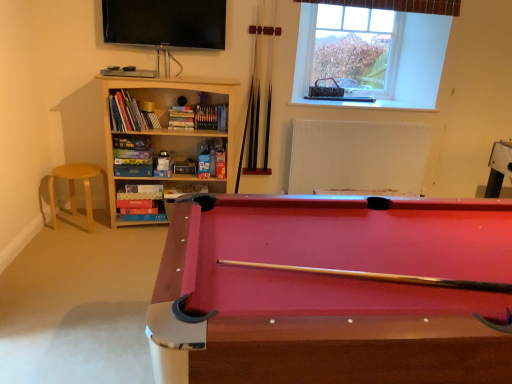
Question: From the image's perspective, is white matte radiator at upper center located above or below wooden bookcase at left?

Choices:
 (A) above
 (B) below

Answer: (B)

Question: Would you say white matte radiator at upper center is to the left or to the right of wooden bookcase at left in the picture?

Choices:
 (A) left
 (B) right

Answer: (B)

Question: Estimate the real-world distances between objects in this image. Which object is farther from the white matte radiator at upper center?

Choices:
 (A) wooden bookcase at left
 (B) clear glass window at upper center
 (C) rubberized wood billiard table at lower right
 (D) light wood stool at left
 (E) flat screen tv at upper center

Answer: (C)

Question: Estimate the real-world distances between objects in this image. Which object is closer to the flat screen tv at upper center?

Choices:
 (A) clear glass window at upper center
 (B) light wood stool at left
 (C) white matte radiator at upper center
 (D) wooden bookcase at left
 (E) rubberized wood billiard table at lower right

Answer: (D)